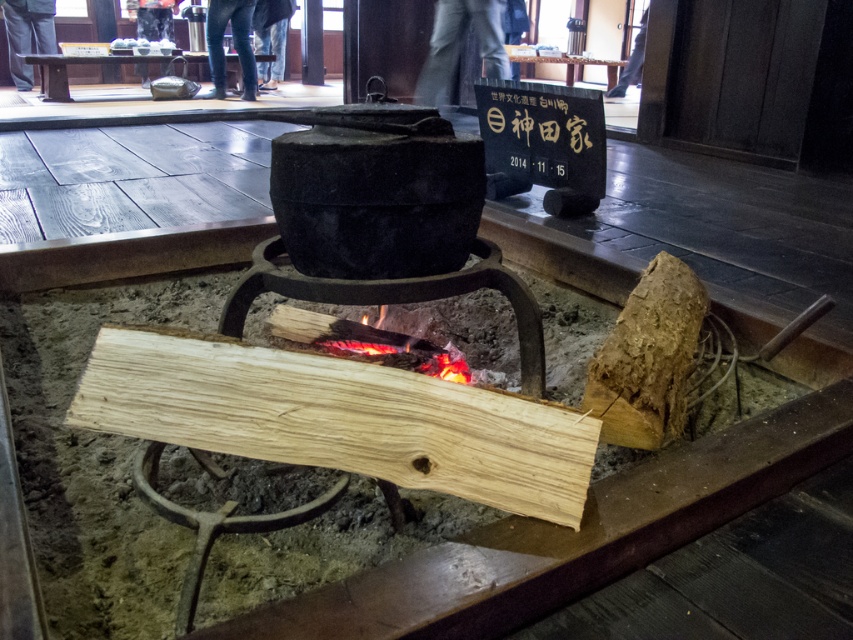
The width and height of the screenshot is (853, 640). What do you see at coordinates (338, 419) in the screenshot? I see `light brown wood at center` at bounding box center [338, 419].

Who is positioned more to the right, light brown wood at center or charcoal fire at center?

charcoal fire at center

Between point (589, 435) and point (347, 342), which one is positioned behind?

Point (347, 342)

Where is `light brown wood at center`? light brown wood at center is located at coordinates (338, 419).